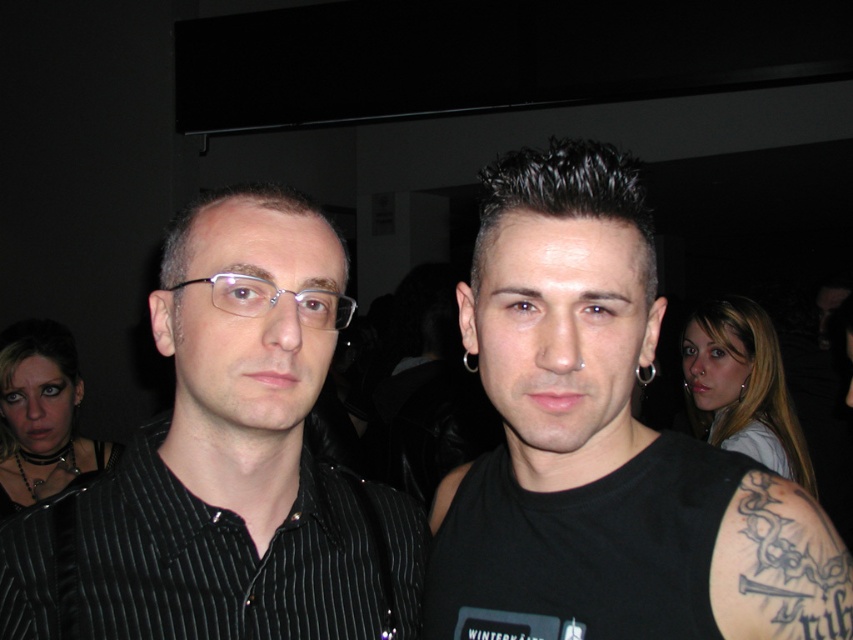
Can you confirm if black pinstripe shirt at left is taller than clear plastic glasses at center?

Correct, black pinstripe shirt at left is much taller as clear plastic glasses at center.

Looking at this image, does black pinstripe shirt at left have a smaller size compared to clear plastic glasses at center?

Actually, black pinstripe shirt at left might be larger than clear plastic glasses at center.

Between point (248, 561) and point (213, 291), which one is positioned behind?

Positioned behind is point (248, 561).

Image resolution: width=853 pixels, height=640 pixels. I want to click on black pinstripe shirt at left, so click(x=227, y=465).

Which of these two, black matte tank top at center or clear plastic glasses at center, stands shorter?

Standing shorter between the two is clear plastic glasses at center.

Does black matte tank top at center have a lesser width compared to clear plastic glasses at center?

In fact, black matte tank top at center might be wider than clear plastic glasses at center.

Image resolution: width=853 pixels, height=640 pixels. Find the location of `black matte tank top at center`. black matte tank top at center is located at coordinates (602, 445).

Does black matte tank top at center have a greater height compared to black pinstripe shirt at left?

Yes, black matte tank top at center is taller than black pinstripe shirt at left.

Does point (505, 458) come in front of point (86, 516)?

No, (505, 458) is further to viewer.

This screenshot has height=640, width=853. I want to click on black matte tank top at center, so pos(602,445).